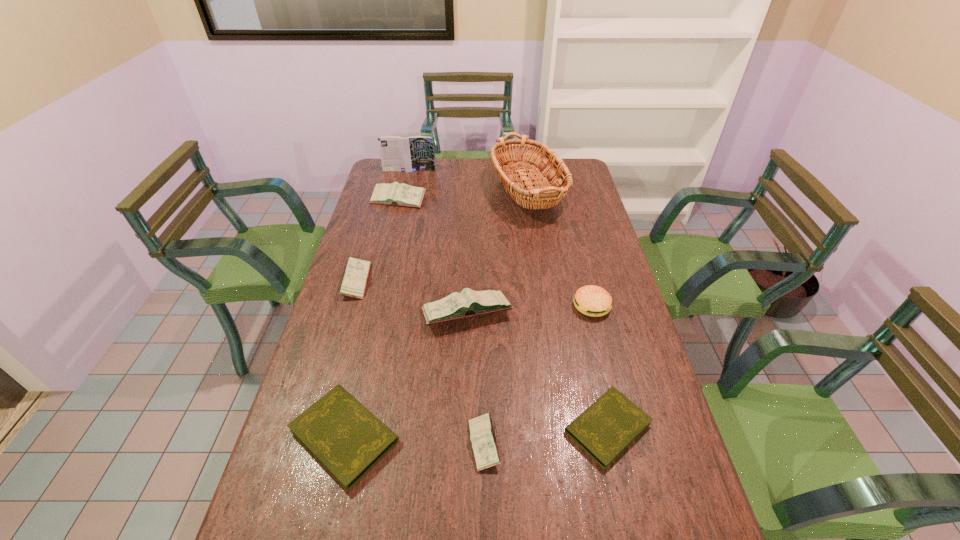
The width and height of the screenshot is (960, 540). Find the location of `blank space that satisfies the following two spatial constraints: 1. on the front side of the brown patty; 2. on the left side of the second smallest pink diary`. blank space that satisfies the following two spatial constraints: 1. on the front side of the brown patty; 2. on the left side of the second smallest pink diary is located at coordinates (349, 306).